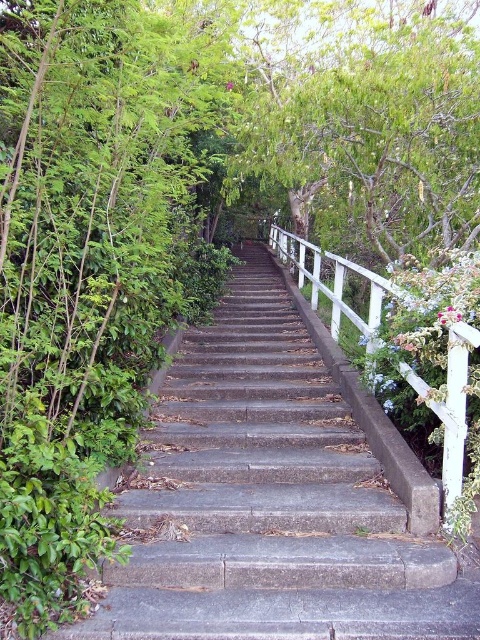
Question: Does gray concrete stairs at center come behind white wooden rail at right?

Choices:
 (A) no
 (B) yes

Answer: (B)

Question: Is gray concrete stairs at center to the right of white wooden rail at right from the viewer's perspective?

Choices:
 (A) no
 (B) yes

Answer: (A)

Question: Which point is farther from the camera taking this photo?

Choices:
 (A) (343, 470)
 (B) (463, 504)

Answer: (A)

Question: Is gray concrete stairs at center above white wooden rail at right?

Choices:
 (A) yes
 (B) no

Answer: (B)

Question: Among these objects, which one is nearest to the camera?

Choices:
 (A) gray concrete stairs at center
 (B) white wooden rail at right

Answer: (B)